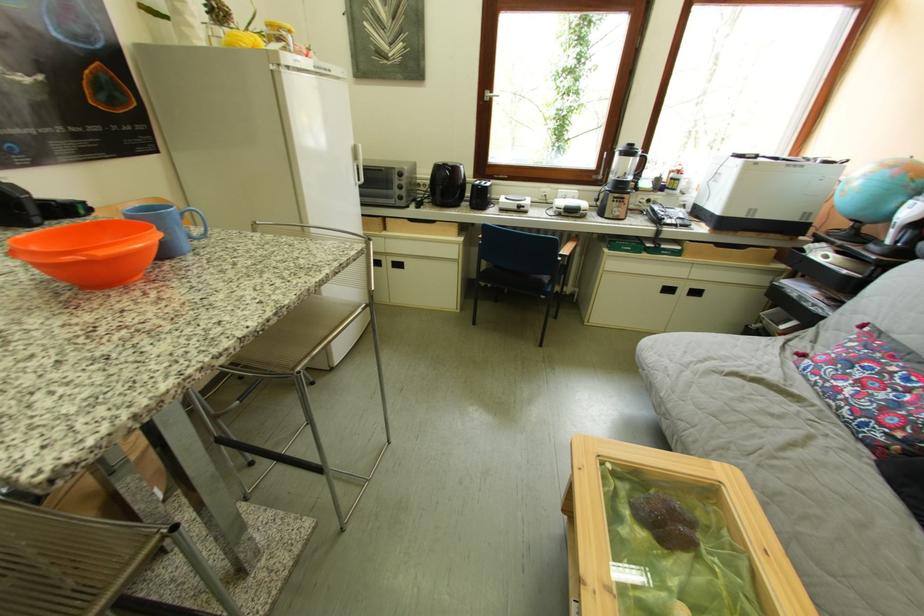
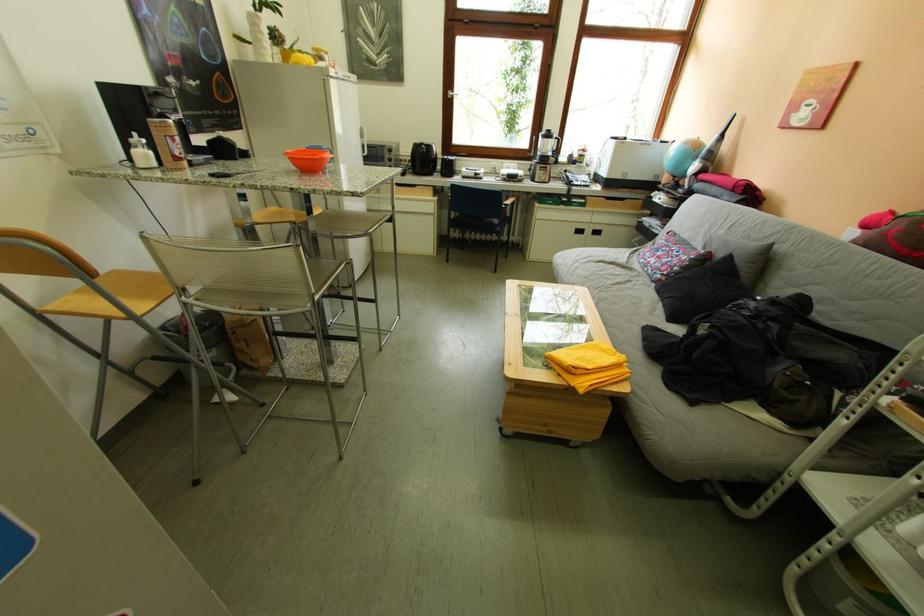
Find the pixel in the second image that matches (859,164) in the first image.

(687, 145)